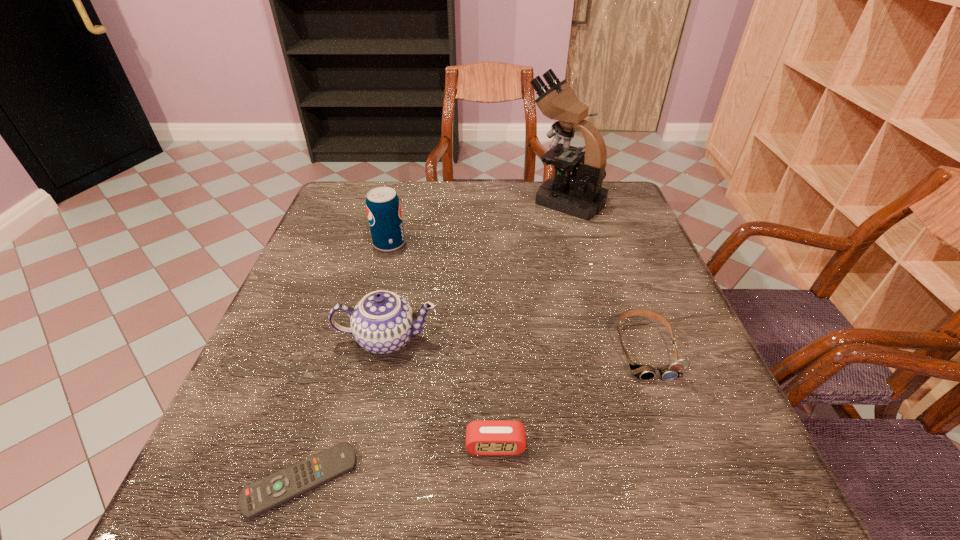
The image size is (960, 540). I want to click on object situated at the near left corner, so click(256, 498).

Where is `object situated at the far right corner`? object situated at the far right corner is located at coordinates (580, 194).

In the image, there is a desktop. What are the coordinates of `free space at the far edge` in the screenshot? It's located at (418, 215).

This screenshot has width=960, height=540. Identify the location of vacant point at the near edge. (391, 507).

This screenshot has width=960, height=540. I want to click on vacant region at the left edge, so tap(283, 453).

This screenshot has width=960, height=540. In order to click on vacant space at the right edge in this screenshot , I will do `click(676, 340)`.

You are a GUI agent. You are given a task and a screenshot of the screen. Output one action in this format:
    pyautogui.click(x=<x>, y=<y>)
    Task: Click on the vacant area at the far left corner of the desktop
    This screenshot has height=540, width=960.
    Given the screenshot: What is the action you would take?
    coord(348,197)

Identify the location of unoccupied position between the remote control and the fourth shortest object. Image resolution: width=960 pixels, height=540 pixels. (344, 410).

Identify the location of vacant area between the alarm clock and the chinaware. The height and width of the screenshot is (540, 960). (442, 393).

This screenshot has width=960, height=540. What are the coordinates of `free area in between the farthest object and the goggles` in the screenshot? It's located at (605, 275).